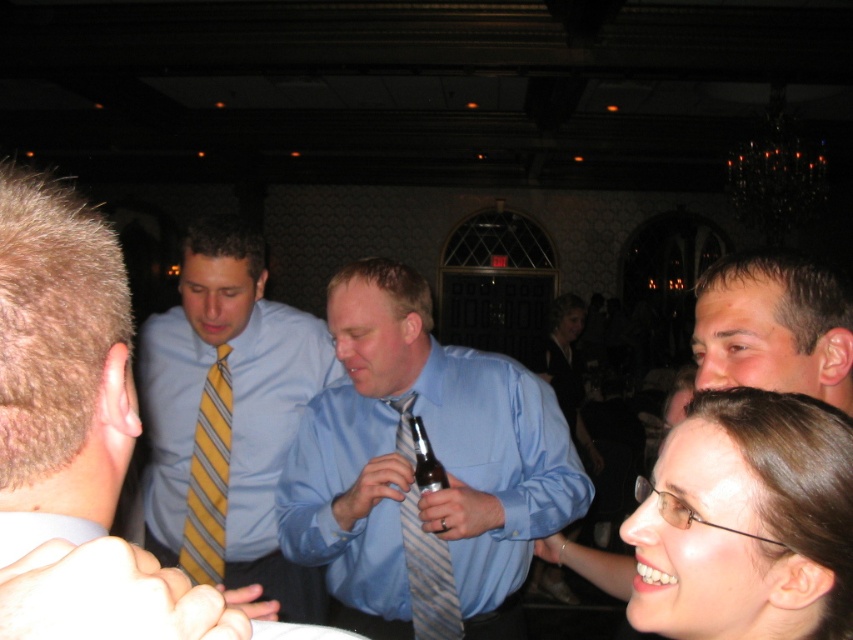
Question: Which point is closer to the camera?

Choices:
 (A) striped fabric tie at center
 (B) blue satin shirt at center
 (C) yellow striped tie at center
 (D) blue silk shirt at center

Answer: (D)

Question: Which object appears farthest from the camera in this image?

Choices:
 (A) smooth brown hair at lower right
 (B) smooth skin face at upper right
 (C) yellow striped tie at left

Answer: (B)

Question: Is blue silk shirt at center below yellow striped tie at center?

Choices:
 (A) yes
 (B) no

Answer: (B)

Question: Estimate the real-world distances between objects in this image. Which object is closer to the smooth skin face at upper right?

Choices:
 (A) smooth brown hair at lower right
 (B) striped fabric tie at center
 (C) blue silk shirt at center
 (D) blue satin shirt at center

Answer: (A)

Question: Is blue silk shirt at center in front of smooth skin face at upper right?

Choices:
 (A) yes
 (B) no

Answer: (B)

Question: Can you confirm if yellow striped tie at center is positioned to the left of striped fabric tie at center?

Choices:
 (A) yes
 (B) no

Answer: (A)